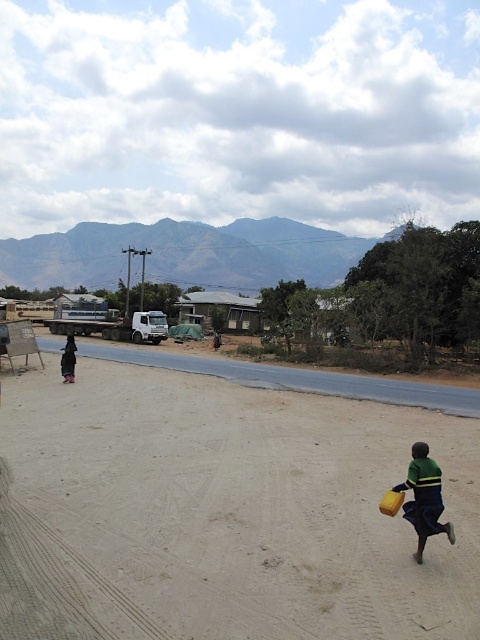
Question: Which point is closer to the camera taking this photo?

Choices:
 (A) (440, 513)
 (B) (133, 616)

Answer: (B)

Question: Which object is positioned closest to the black fabric child at left?

Choices:
 (A) brown sandy dirt track at lower center
 (B) green jersey at lower right

Answer: (A)

Question: Which of the following is the closest to the observer?

Choices:
 (A) (414, 518)
 (B) (155, 628)
 (C) (66, 355)

Answer: (B)

Question: Is brown sandy dirt track at lower center to the right of black fabric child at left from the viewer's perspective?

Choices:
 (A) no
 (B) yes

Answer: (B)

Question: Is brown sandy dirt track at lower center closer to camera compared to green jersey at lower right?

Choices:
 (A) no
 (B) yes

Answer: (B)

Question: Is brown sandy dirt track at lower center bigger than green jersey at lower right?

Choices:
 (A) no
 (B) yes

Answer: (B)